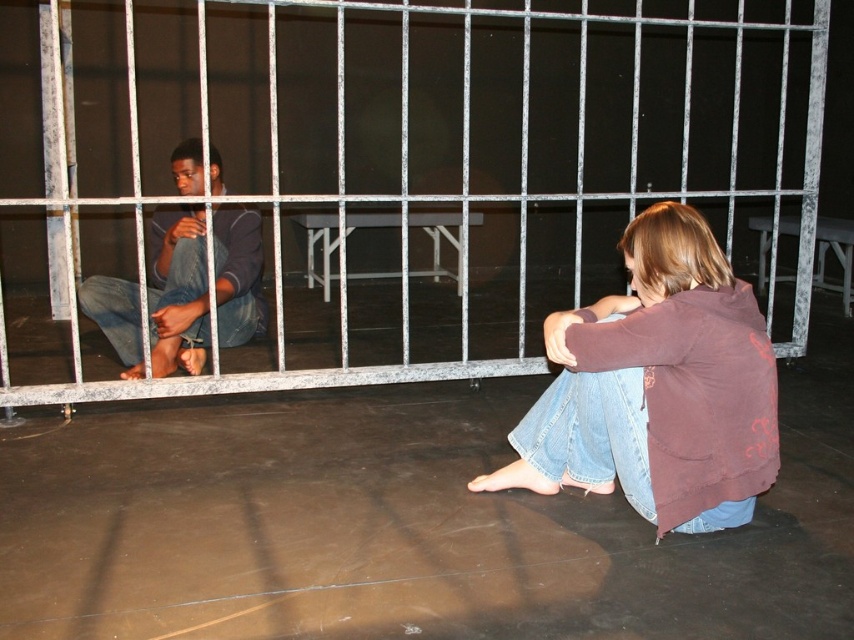
You are a visitor in this indoor scene and want to approach the brown cotton hoodie at lower right from the entrance located to your left. Is the metallic silver cage at center blocking your path?

The metallic silver cage at center is to the right of the brown cotton hoodie at lower right, so the cage is not directly in your path. You can approach the brown cotton hoodie at lower right by moving around the cage on the left side.

You are an interior designer planning to place a new sofa in the room where the metallic silver cage at center and brown cotton hoodie at lower right are located. Based on their sizes, which object would require more space for placement?

The brown cotton hoodie at lower right requires more space for placement since the metallic silver cage at center occupies less space than it.

You are a security guard in a museum and need to ensure that the metallic silver cage at center can accommodate a new exhibit. The exhibit requires a minimum height of 1.5 meters. Given that the dark blue jeans at left are 1 meter in height, can the cage accommodate the exhibit?

The metallic silver cage at center is shorter than the dark blue jeans at left, which are 1 meter in height. Since the cage is shorter than 1 meter, it cannot accommodate the exhibit requiring a minimum height of 1.5 meters.